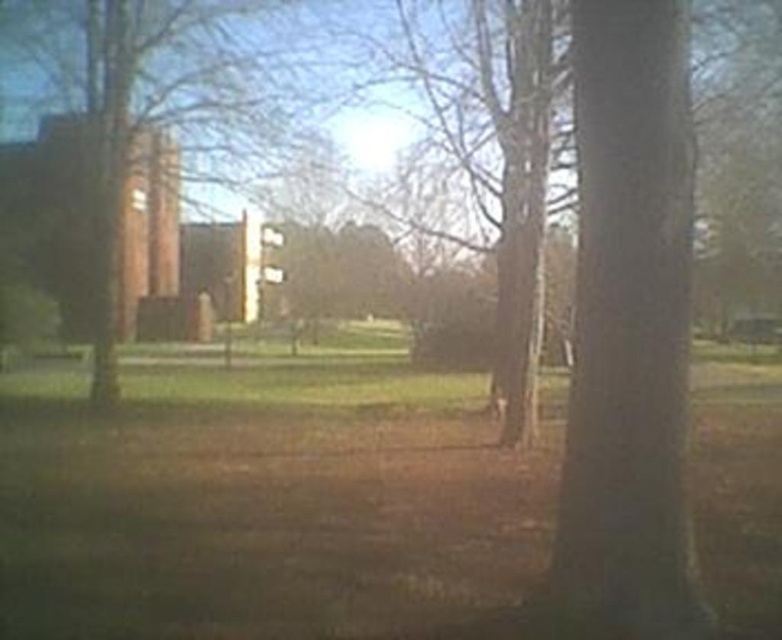
Question: Estimate the real-world distances between objects in this image. Which object is closer to the green grass at center?

Choices:
 (A) brown wood tree at left
 (B) smooth bark tree at center

Answer: (A)

Question: Is green grass at center thinner than brown wood tree at left?

Choices:
 (A) no
 (B) yes

Answer: (A)

Question: Is green grass at center positioned in front of brown wood tree at left?

Choices:
 (A) no
 (B) yes

Answer: (B)

Question: Among these objects, which one is nearest to the camera?

Choices:
 (A) green grass at center
 (B) brown wood tree at left
 (C) smooth bark tree at center

Answer: (C)

Question: Can you confirm if green grass at center is positioned to the left of brown wood tree at left?

Choices:
 (A) yes
 (B) no

Answer: (B)

Question: Among these points, which one is nearest to the camera?

Choices:
 (A) (745, 424)
 (B) (662, 227)
 (C) (67, 49)

Answer: (B)